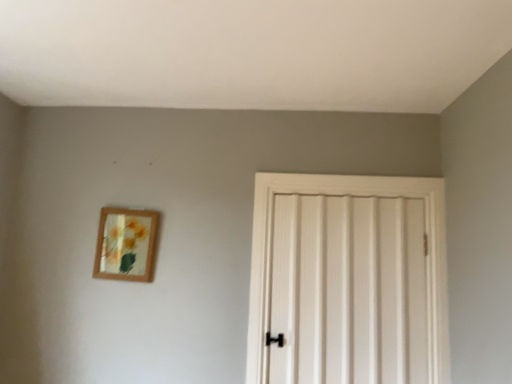
Measure the distance between point (134, 211) and camera.

Point (134, 211) is 2.24 meters away from camera.

What do you see at coordinates (126, 244) in the screenshot?
I see `wooden frame at upper left` at bounding box center [126, 244].

In order to face wooden frame at upper left, should I rotate leftwards or rightwards?

You should rotate left by 17.348 degrees.

In order to click on wooden frame at upper left in this screenshot , I will do `click(126, 244)`.

This screenshot has width=512, height=384. What do you see at coordinates (348, 280) in the screenshot? I see `white wooden door at center` at bounding box center [348, 280].

This screenshot has height=384, width=512. I want to click on white wooden door at center, so click(348, 280).

What is the approximate height of white wooden door at center?

white wooden door at center is 3.48 feet in height.

The image size is (512, 384). In order to click on wooden frame at upper left in this screenshot , I will do `click(126, 244)`.

Based on the photo, is wooden frame at upper left to the right of white wooden door at center from the viewer's perspective?

In fact, wooden frame at upper left is to the left of white wooden door at center.

In the image, is wooden frame at upper left positioned in front of or behind white wooden door at center?

wooden frame at upper left is behind white wooden door at center.

Does point (153, 216) appear closer or farther from the camera than point (286, 349)?

Point (153, 216) is farther from the camera than point (286, 349).

From the image's perspective, is wooden frame at upper left above white wooden door at center?

Yes, from the image's perspective, wooden frame at upper left is above white wooden door at center.

From a real-world perspective, who is located higher, wooden frame at upper left or white wooden door at center?

wooden frame at upper left, from a real-world perspective.

Looking at this image, which of these two, wooden frame at upper left or white wooden door at center, is wider?

white wooden door at center.

Considering the relative sizes of wooden frame at upper left and white wooden door at center in the image provided, is wooden frame at upper left shorter than white wooden door at center?

Correct, wooden frame at upper left is not as tall as white wooden door at center.

Which of these two, wooden frame at upper left or white wooden door at center, is bigger?

Bigger between the two is white wooden door at center.

Is wooden frame at upper left inside the boundaries of white wooden door at center, or outside?

The correct answer is: outside.

Would you consider wooden frame at upper left to be distant from white wooden door at center?

No.

In the scene shown: Is wooden frame at upper left turned away from white wooden door at center?

No, wooden frame at upper left is not facing away from white wooden door at center.

How different are the orientations of wooden frame at upper left and white wooden door at center in degrees?

The angle between the facing direction of wooden frame at upper left and the facing direction of white wooden door at center is 1.88 degrees.

How distant is wooden frame at upper left from white wooden door at center?

They are 34.20 inches apart.

Identify the location of door on the right of wooden frame at upper left. (348, 280).

Does white wooden door at center appear on the left side of wooden frame at upper left?

No, white wooden door at center is not to the left of wooden frame at upper left.

Is white wooden door at center in front of wooden frame at upper left?

That is True.

Does point (408, 280) come closer to viewer compared to point (152, 231)?

Yes, point (408, 280) is in front of point (152, 231).

From the image's perspective, is white wooden door at center above or below wooden frame at upper left?

white wooden door at center is below wooden frame at upper left.

From a real-world perspective, which is physically below, white wooden door at center or wooden frame at upper left?

white wooden door at center is physically lower.

Considering the relative sizes of white wooden door at center and wooden frame at upper left in the image provided, is white wooden door at center thinner than wooden frame at upper left?

No, white wooden door at center is not thinner than wooden frame at upper left.

Who is taller, white wooden door at center or wooden frame at upper left?

white wooden door at center.

Can you confirm if white wooden door at center is bigger than wooden frame at upper left?

Yes.

Is white wooden door at center located outside wooden frame at upper left?

That's correct, white wooden door at center is outside of wooden frame at upper left.

Is there a large distance between white wooden door at center and wooden frame at upper left?

That's not correct — white wooden door at center is a little close to wooden frame at upper left.

Is white wooden door at center oriented away from wooden frame at upper left?

No, white wooden door at center's orientation is not away from wooden frame at upper left.

Locate an element on the screen. The height and width of the screenshot is (384, 512). door that is under the wooden frame at upper left (from a real-world perspective) is located at coordinates pos(348,280).

At what (x,y) coordinates should I click in order to perform the action: click on door on the right of wooden frame at upper left. Please return your answer as a coordinate pair (x, y). Looking at the image, I should click on (348, 280).

This screenshot has width=512, height=384. What are the coordinates of `door that is below the wooden frame at upper left (from the image's perspective)` in the screenshot? It's located at (348, 280).